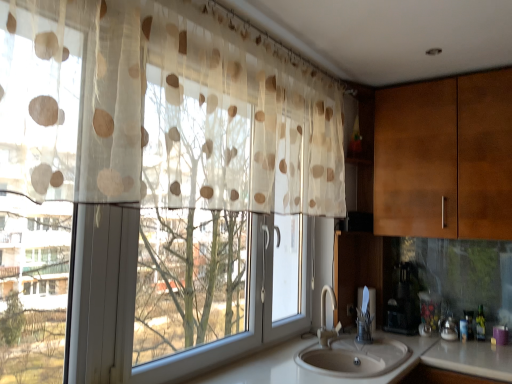
Question: Is black plastic coffee maker at lower right looking in the opposite direction of white ceramic sink at lower center?

Choices:
 (A) no
 (B) yes

Answer: (A)

Question: Is black plastic coffee maker at lower right completely or partially outside of white ceramic sink at lower center?

Choices:
 (A) yes
 (B) no

Answer: (A)

Question: Considering the relative sizes of black plastic coffee maker at lower right and white ceramic sink at lower center in the image provided, is black plastic coffee maker at lower right smaller than white ceramic sink at lower center?

Choices:
 (A) no
 (B) yes

Answer: (B)

Question: Considering the relative positions of black plastic coffee maker at lower right and white ceramic sink at lower center in the image provided, is black plastic coffee maker at lower right behind white ceramic sink at lower center?

Choices:
 (A) yes
 (B) no

Answer: (A)

Question: From a real-world perspective, is black plastic coffee maker at lower right below white ceramic sink at lower center?

Choices:
 (A) no
 (B) yes

Answer: (A)

Question: Are black plastic coffee maker at lower right and white ceramic sink at lower center located far from each other?

Choices:
 (A) no
 (B) yes

Answer: (A)

Question: Is white glossy counter top at lower center facing away from translucent plastic bottle at sink right?

Choices:
 (A) yes
 (B) no

Answer: (B)

Question: Can you confirm if white glossy counter top at lower center is shorter than translucent plastic bottle at sink right?

Choices:
 (A) yes
 (B) no

Answer: (B)

Question: Is white glossy counter top at lower center outside of translucent plastic bottle at sink right?

Choices:
 (A) yes
 (B) no

Answer: (A)

Question: Is white glossy counter top at lower center touching translucent plastic bottle at sink right?

Choices:
 (A) no
 (B) yes

Answer: (A)

Question: Is white glossy counter top at lower center bigger than translucent plastic bottle at sink right?

Choices:
 (A) no
 (B) yes

Answer: (B)

Question: Is white glossy counter top at lower center positioned behind translucent plastic bottle at sink right?

Choices:
 (A) no
 (B) yes

Answer: (A)

Question: Is black plastic coffee maker at lower right facing towards translucent beige polka dot curtain at left?

Choices:
 (A) yes
 (B) no

Answer: (B)